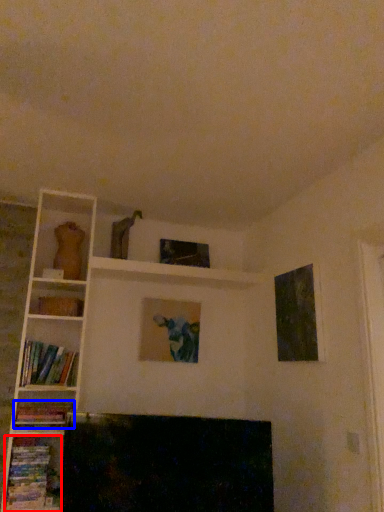
Question: Which object appears closest to the camera in this image, book (highlighted by a red box) or book (highlighted by a blue box)?

Choices:
 (A) book
 (B) book

Answer: (A)